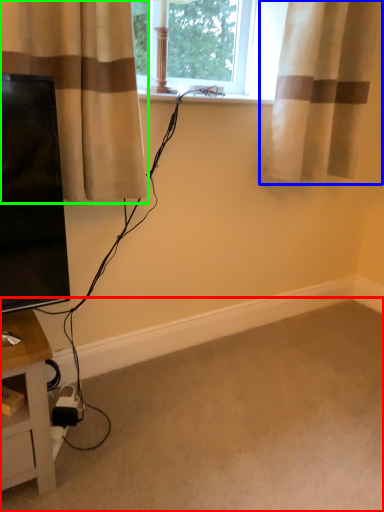
Question: Estimate the real-world distances between objects in this image. Which object is closer to plain (highlighted by a red box), curtain (highlighted by a blue box) or curtain (highlighted by a green box)?

Choices:
 (A) curtain
 (B) curtain

Answer: (B)